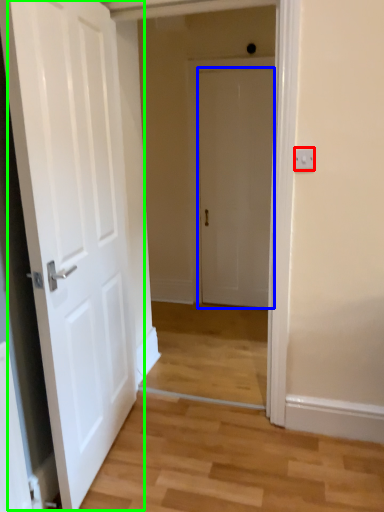
Question: Based on their relative distances, which object is farther from electric outlet (highlighted by a red box)? Choose from door (highlighted by a blue box) and door (highlighted by a green box).

Choices:
 (A) door
 (B) door

Answer: (A)